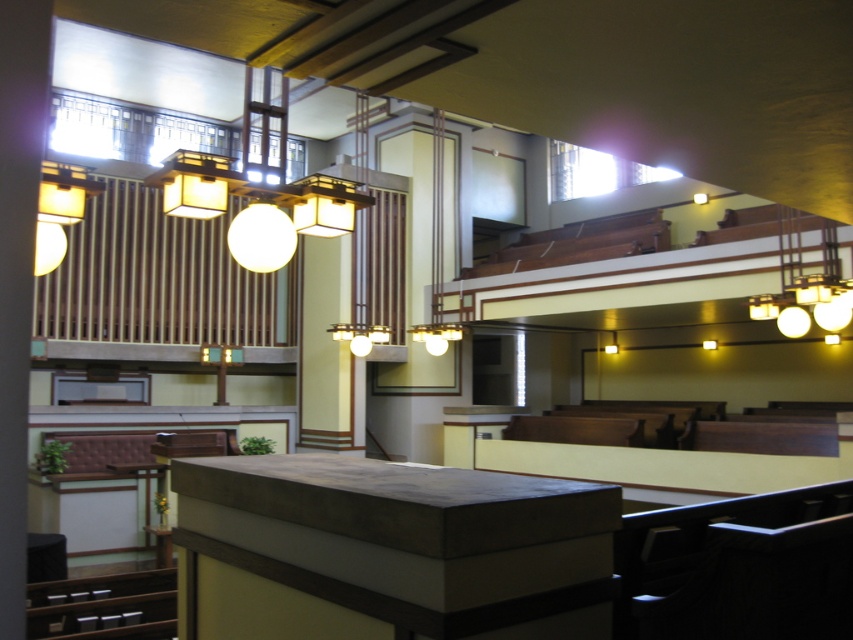
Can you confirm if matte gold chandelier at upper center is positioned to the left of matte white chandelier at upper right?

Yes, matte gold chandelier at upper center is to the left of matte white chandelier at upper right.

Who is higher up, matte gold chandelier at upper center or matte white chandelier at upper right?

matte gold chandelier at upper center

Does point (260, 173) come behind point (828, 300)?

No.

I want to click on matte gold chandelier at upper center, so click(259, 186).